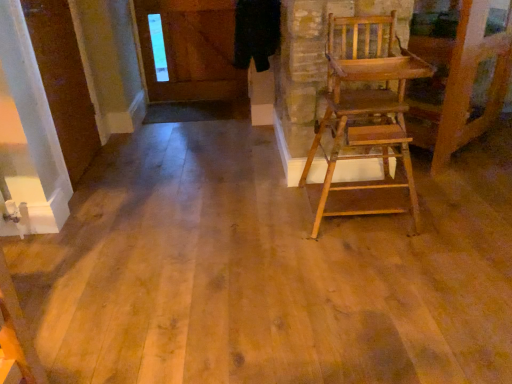
Question: Should I look upward or downward to see white glossy door at upper left?

Choices:
 (A) up
 (B) down

Answer: (A)

Question: Is the position of white glossy door at upper left less distant than that of wooden high chair at right?

Choices:
 (A) no
 (B) yes

Answer: (A)

Question: Does white glossy door at upper left have a larger size compared to wooden high chair at right?

Choices:
 (A) no
 (B) yes

Answer: (A)

Question: From a real-world perspective, is white glossy door at upper left on wooden high chair at right?

Choices:
 (A) yes
 (B) no

Answer: (A)

Question: Can you confirm if white glossy door at upper left is taller than wooden high chair at right?

Choices:
 (A) no
 (B) yes

Answer: (B)

Question: Would you say white glossy door at upper left is a long distance from wooden high chair at right?

Choices:
 (A) yes
 (B) no

Answer: (A)

Question: Is white glossy door at upper left completely or partially outside of wooden high chair at right?

Choices:
 (A) yes
 (B) no

Answer: (A)

Question: Considering the relative sizes of wooden high chair at right and white glossy door at upper left in the image provided, is wooden high chair at right bigger than white glossy door at upper left?

Choices:
 (A) yes
 (B) no

Answer: (A)

Question: Considering the relative sizes of wooden high chair at right and white glossy door at upper left in the image provided, is wooden high chair at right thinner than white glossy door at upper left?

Choices:
 (A) yes
 (B) no

Answer: (B)

Question: Is wooden high chair at right in contact with white glossy door at upper left?

Choices:
 (A) yes
 (B) no

Answer: (B)

Question: Is white glossy door at upper left completely or partially inside wooden high chair at right?

Choices:
 (A) no
 (B) yes

Answer: (A)

Question: Would you say wooden high chair at right is a long distance from white glossy door at upper left?

Choices:
 (A) no
 (B) yes

Answer: (B)

Question: Considering the relative sizes of wooden high chair at right and white glossy door at upper left in the image provided, is wooden high chair at right taller than white glossy door at upper left?

Choices:
 (A) yes
 (B) no

Answer: (B)

Question: Relative to wooden high chair at right, is white glossy door at upper left in front or behind?

Choices:
 (A) front
 (B) behind

Answer: (B)